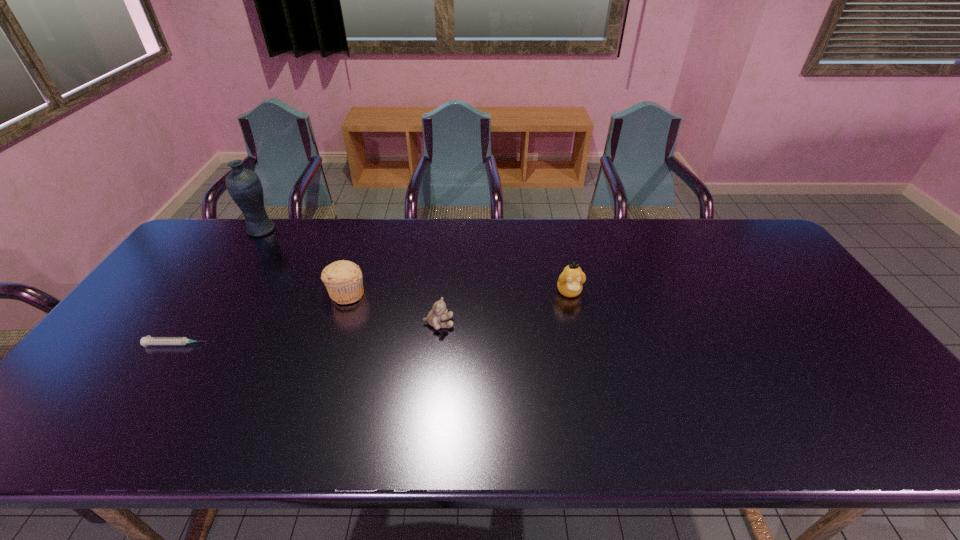
I want to click on free spot located 0.160m on the front of the third object from left to right, so click(x=327, y=352).

Image resolution: width=960 pixels, height=540 pixels. Find the location of `free spot located 0.390m on the face of the fourth object from left to right`. free spot located 0.390m on the face of the fourth object from left to right is located at coordinates (596, 323).

Locate an element on the screen. The image size is (960, 540). free point located at the needle end of the syringe is located at coordinates (x=271, y=345).

What are the coordinates of `object that is at the far edge` in the screenshot? It's located at (244, 186).

In order to click on vase that is positioned at the left edge in this screenshot , I will do `click(244, 186)`.

Locate an element on the screen. The image size is (960, 540). syringe that is at the left edge is located at coordinates 148,340.

At what (x,y) coordinates should I click in order to perform the action: click on object at the far left corner. Please return your answer as a coordinate pair (x, y). Looking at the image, I should click on (244, 186).

In order to click on free space at the far edge of the desktop in this screenshot , I will do `click(505, 238)`.

This screenshot has height=540, width=960. Identify the location of vacant space at the near edge. (590, 413).

You are a GUI agent. You are given a task and a screenshot of the screen. Output one action in this format:
    pyautogui.click(x=<x>, y=<y>)
    Task: Click on the vacant region at the far right corner of the desktop
    
    Given the screenshot: What is the action you would take?
    pyautogui.click(x=723, y=242)